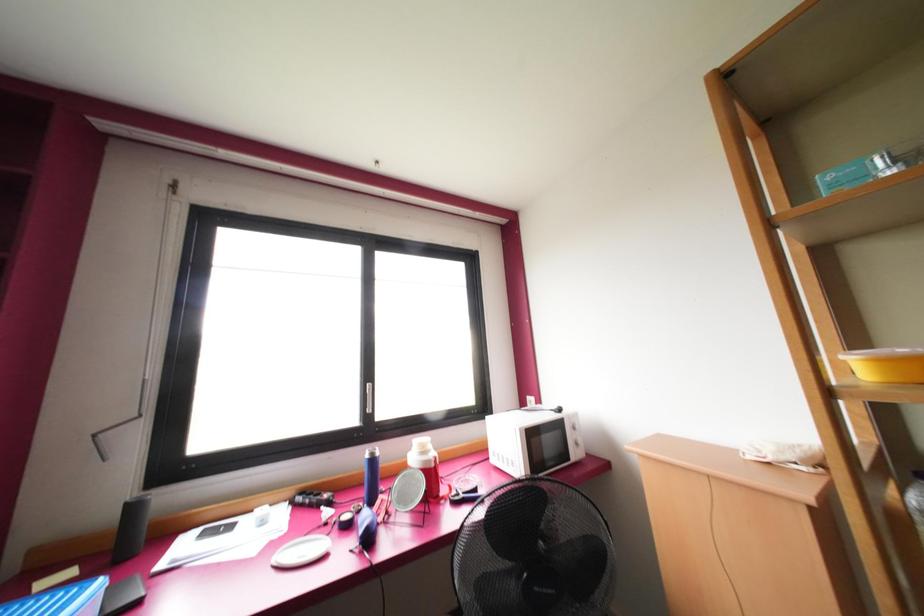
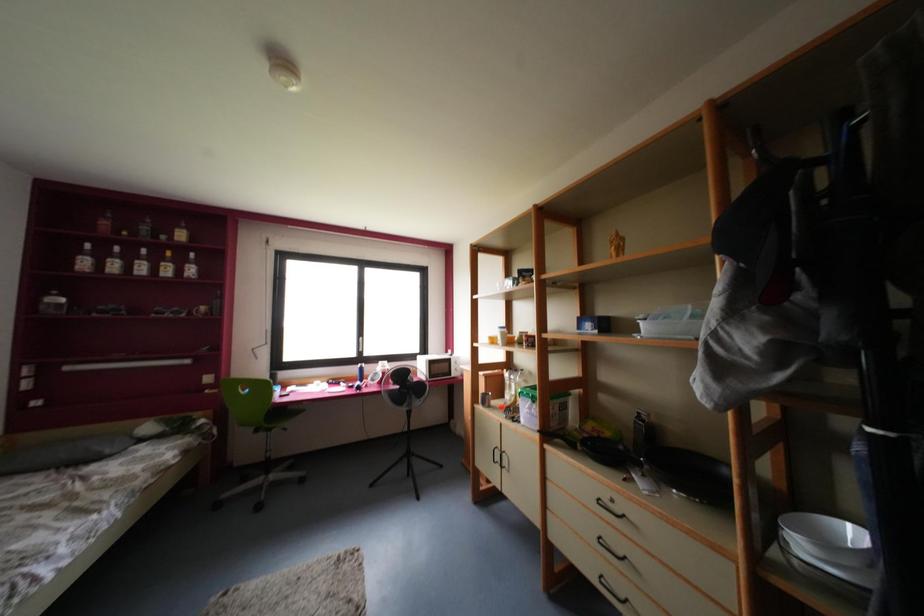
Which direction would the cameraman need to move to produce the second image?

The cameraman moved toward right, backward.